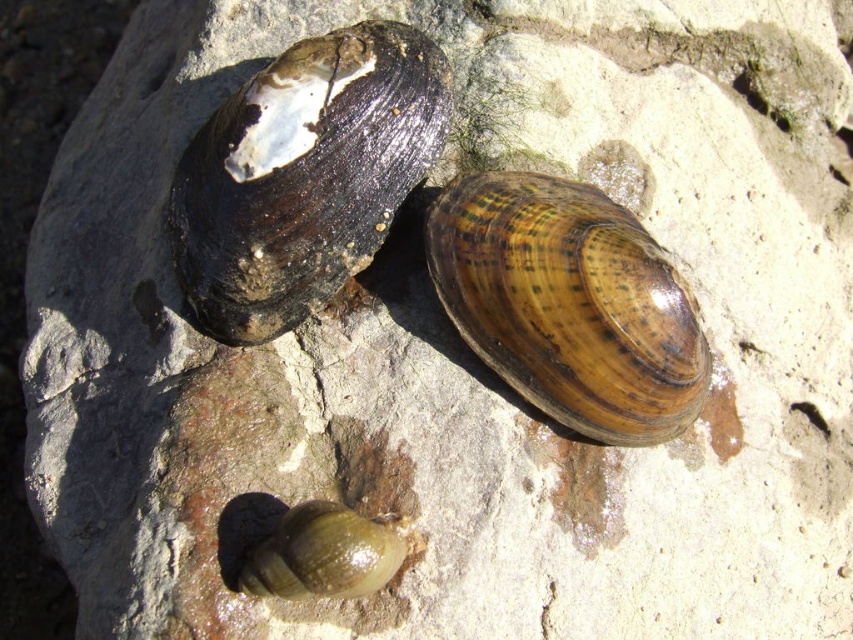
Which of these two, shiny black shell at upper left or green glossy snail at lower center, stands shorter?

With less height is green glossy snail at lower center.

Which is above, shiny black shell at upper left or green glossy snail at lower center?

shiny black shell at upper left

Who is more distant from viewer, (227, 339) or (381, 577)?

Point (227, 339)

I want to click on shiny black shell at upper left, so click(305, 176).

Which of these two, shiny black shell at upper left or brown textured shell at center, stands taller?

shiny black shell at upper left is taller.

Which is in front, point (346, 104) or point (683, 420)?

Point (346, 104) is in front.

The width and height of the screenshot is (853, 640). What are the coordinates of `shiny black shell at upper left` in the screenshot? It's located at (305, 176).

Is point (547, 212) closer to camera compared to point (287, 509)?

No, it is not.

Is brown textured shell at center thinner than green glossy snail at lower center?

No, brown textured shell at center is not thinner than green glossy snail at lower center.

You are a GUI agent. You are given a task and a screenshot of the screen. Output one action in this format:
    pyautogui.click(x=<x>, y=<y>)
    Task: Click on the brown textured shell at center
    The height and width of the screenshot is (640, 853).
    Given the screenshot: What is the action you would take?
    [569, 305]